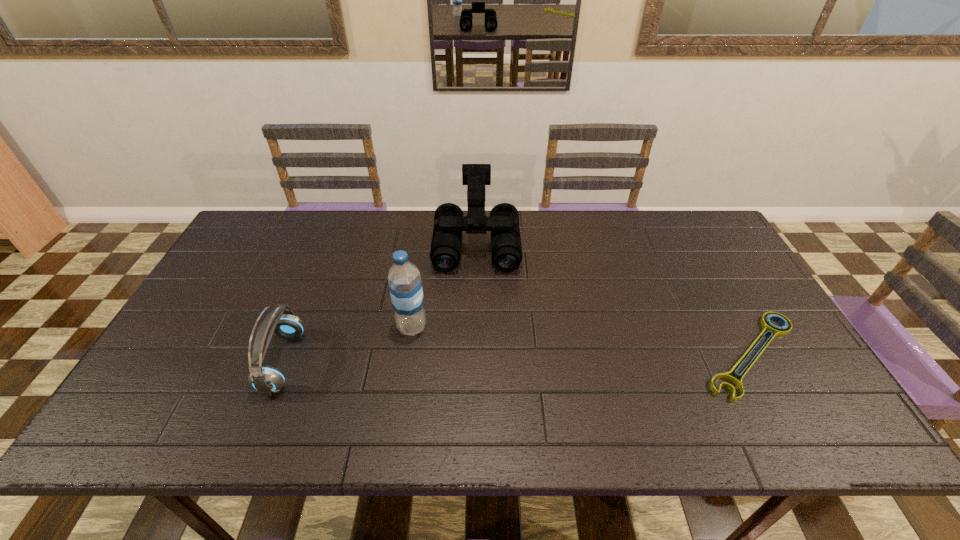
Locate an element on the screen. The image size is (960, 540). object that is at the right edge is located at coordinates (771, 329).

Locate an element on the screen. The image size is (960, 540). object positioned at the near right corner is located at coordinates (771, 329).

The image size is (960, 540). What are the coordinates of `free space at the far edge of the desktop` in the screenshot? It's located at (318, 246).

The width and height of the screenshot is (960, 540). Find the location of `free space at the near edge`. free space at the near edge is located at coordinates (547, 370).

What are the coordinates of `vacant region at the left edge of the desktop` in the screenshot? It's located at click(x=232, y=326).

Where is `vacant area at the right edge`? The width and height of the screenshot is (960, 540). vacant area at the right edge is located at coordinates (752, 308).

Find the location of a particular element. The width and height of the screenshot is (960, 540). vacant point located between the wrench and the water bottle is located at coordinates (582, 341).

Locate an element on the screen. Image resolution: width=960 pixels, height=540 pixels. free space between the rightmost object and the second shortest object is located at coordinates (517, 359).

Identify the location of free space between the wrench and the headset. The image size is (960, 540). (517, 359).

Find the location of a particular element. free spot between the farthest object and the headset is located at coordinates (380, 302).